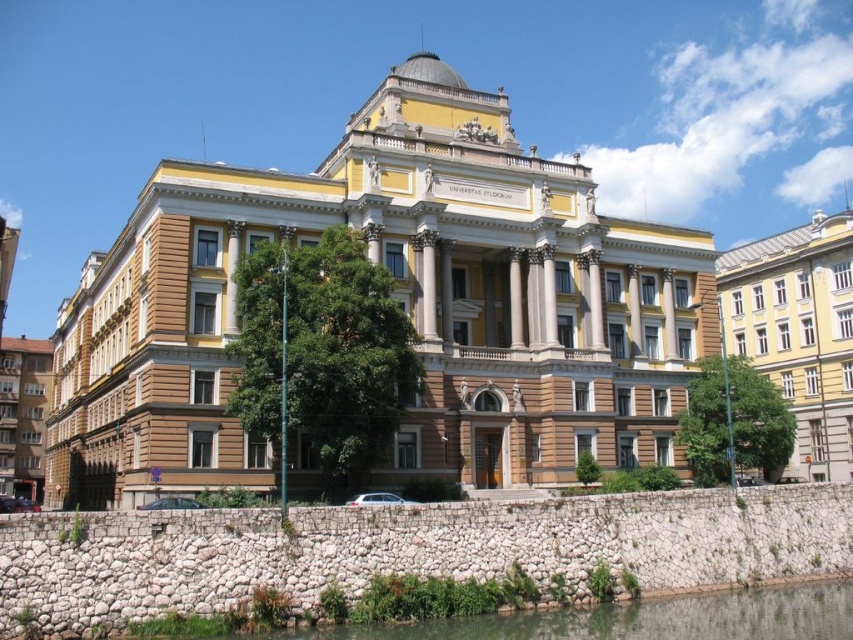
Question: Considering the relative positions of yellow matte building at right and clear water at lower center in the image provided, where is yellow matte building at right located with respect to clear water at lower center?

Choices:
 (A) above
 (B) below

Answer: (A)

Question: Among these objects, which one is nearest to the camera?

Choices:
 (A) yellow matte building at right
 (B) brown stone building at center

Answer: (B)

Question: Does yellow matte building at right have a smaller size compared to clear water at lower center?

Choices:
 (A) no
 (B) yes

Answer: (A)

Question: In this image, where is yellow matte building at right located relative to clear water at lower center?

Choices:
 (A) above
 (B) below

Answer: (A)

Question: Among these points, which one is nearest to the camera?

Choices:
 (A) (849, 237)
 (B) (408, 634)

Answer: (B)

Question: Among these points, which one is nearest to the camera?

Choices:
 (A) (849, 460)
 (B) (426, 262)

Answer: (B)